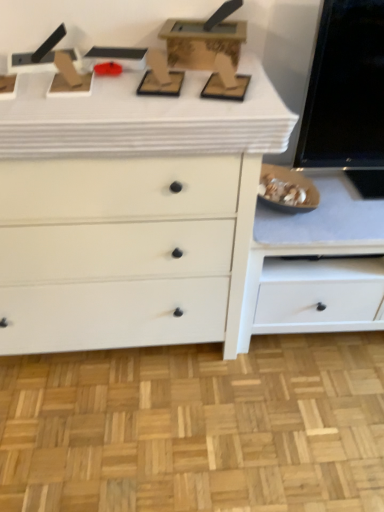
This screenshot has height=512, width=384. Identify the location of empty space that is ontop of white matte cabinet at lower right (from a real-world perspective). (334, 201).